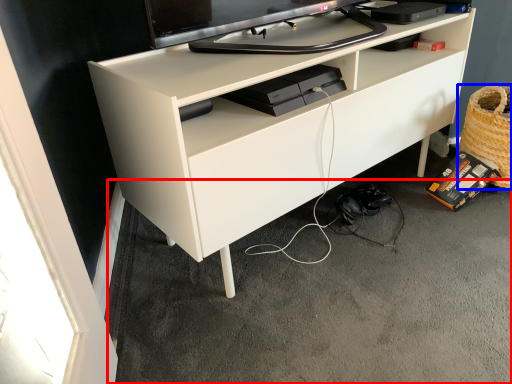
Question: Among these objects, which one is farthest to the camera, concrete (highlighted by a red box) or basket (highlighted by a blue box)?

Choices:
 (A) concrete
 (B) basket

Answer: (B)